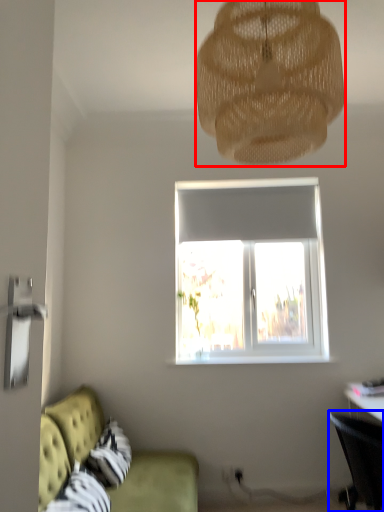
Question: Which point is closer to the camera, lamp (highlighted by a red box) or chair (highlighted by a blue box)?

Choices:
 (A) lamp
 (B) chair

Answer: (A)